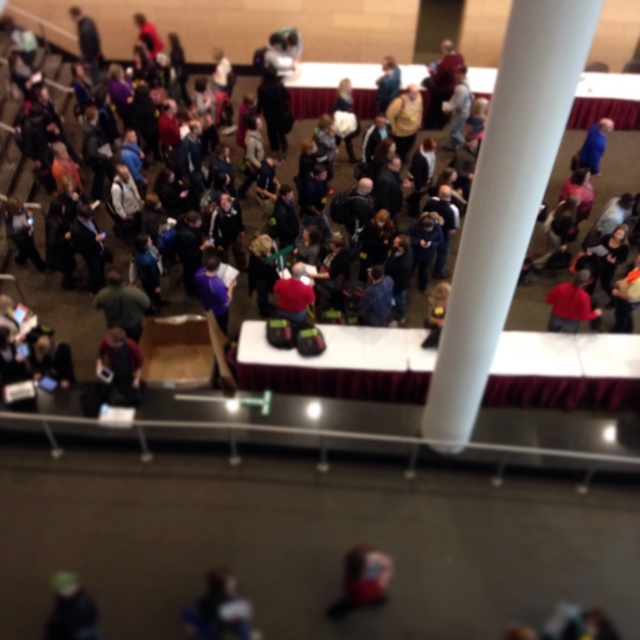
Is point (122, 42) farther from camera compared to point (96, 621)?

Yes, it is behind point (96, 621).

Is dark gray hoodie at center in front of green knit hat at lower left?

That is True.

Where is `dark gray hoodie at center`? dark gray hoodie at center is located at coordinates (198, 19).

What do you see at coordinates (70, 609) in the screenshot?
I see `green knit hat at lower left` at bounding box center [70, 609].

Who is lower down, green knit hat at lower left or red matte shirt at center?

green knit hat at lower left is lower down.

Describe the element at coordinates (70, 609) in the screenshot. The width and height of the screenshot is (640, 640). I see `green knit hat at lower left` at that location.

What are the coordinates of `green knit hat at lower left` in the screenshot? It's located at (70, 609).

In the scene shown: Is dark gray hoodie at center bigger than red matte shirt at center?

Yes, dark gray hoodie at center is bigger than red matte shirt at center.

Does dark gray hoodie at center appear on the right side of red matte shirt at center?

In fact, dark gray hoodie at center is to the left of red matte shirt at center.

I want to click on dark gray hoodie at center, so click(x=198, y=19).